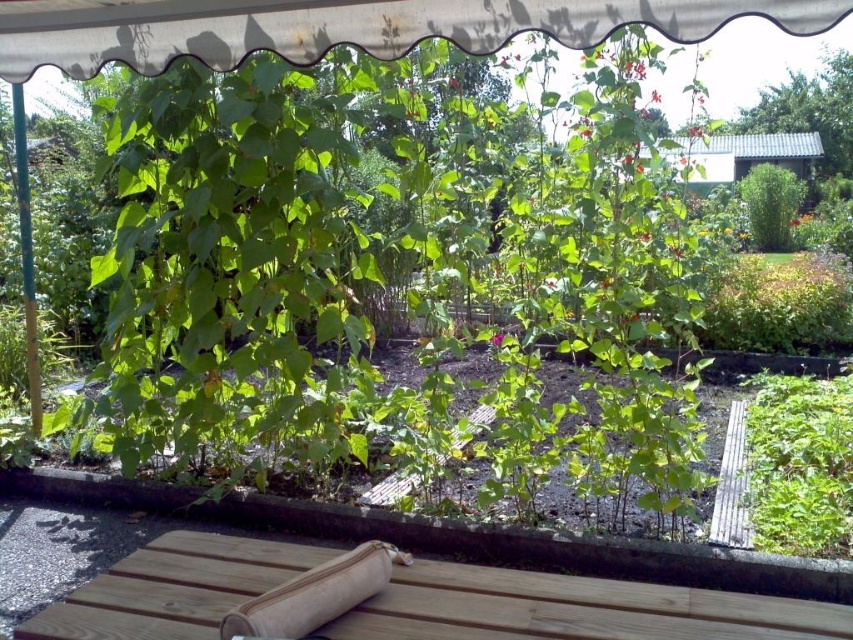
Who is lower down, green leafy plant at center or beige fabric rolling pin at lower center?

green leafy plant at center

Is point (795, 509) positioned in front of point (343, 573)?

No, it is behind (343, 573).

This screenshot has height=640, width=853. In order to click on green leafy plant at center in this screenshot , I will do `click(799, 465)`.

Is natural wood picnic table at lower center above green leafy plant at center?

Indeed, natural wood picnic table at lower center is positioned over green leafy plant at center.

Between natural wood picnic table at lower center and green leafy plant at center, which one appears on the right side from the viewer's perspective?

green leafy plant at center

Who is more forward, (x=751, y=628) or (x=822, y=403)?

Point (x=751, y=628) is in front.

This screenshot has width=853, height=640. In order to click on natural wood picnic table at lower center in this screenshot , I will do `click(573, 609)`.

Can you confirm if natural wood picnic table at lower center is positioned to the right of beige fabric rolling pin at lower center?

Correct, you'll find natural wood picnic table at lower center to the right of beige fabric rolling pin at lower center.

The image size is (853, 640). In order to click on natural wood picnic table at lower center in this screenshot , I will do `click(573, 609)`.

Is point (358, 605) closer to viewer compared to point (316, 593)?

No, it is not.

Find the location of a particular element. This screenshot has width=853, height=640. natural wood picnic table at lower center is located at coordinates (573, 609).